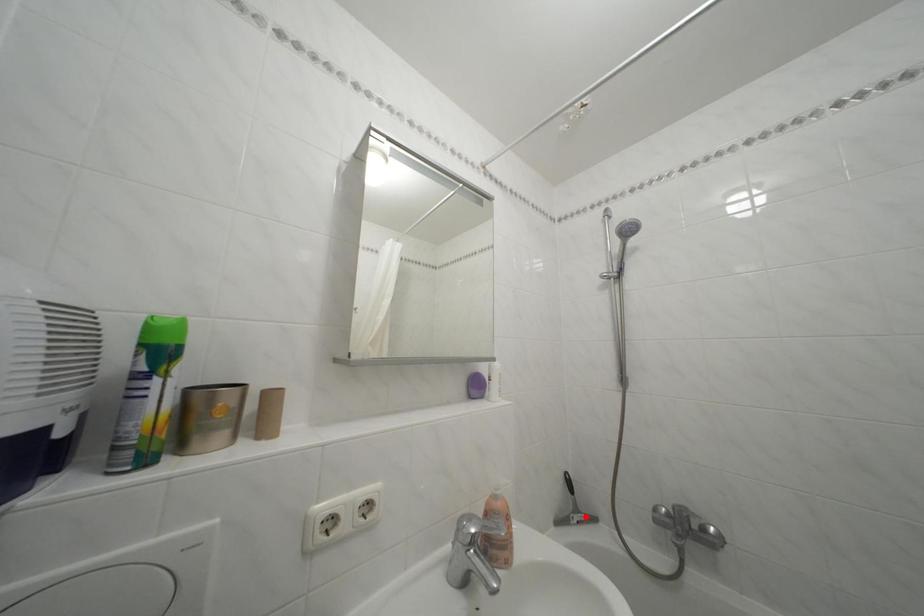
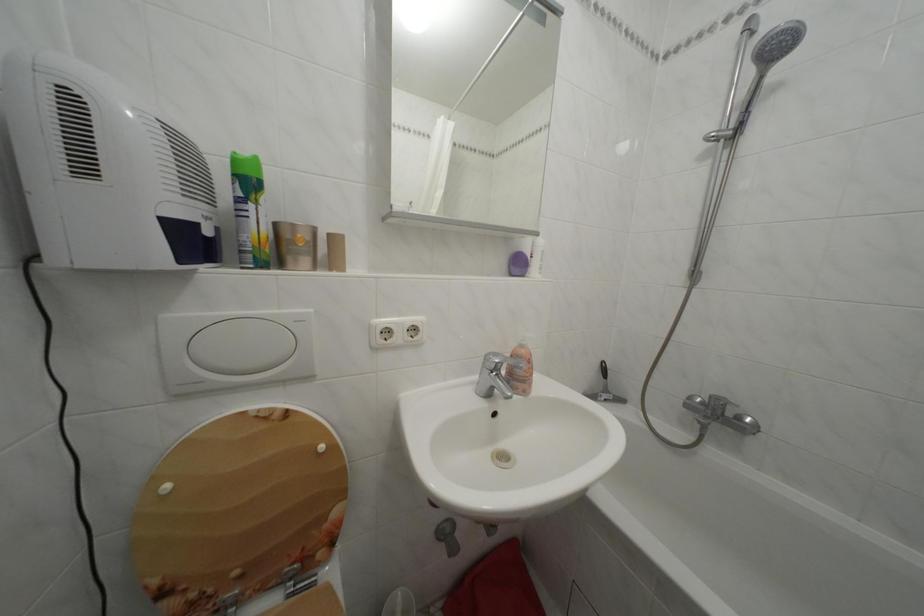
Find the pixel in the second image that matches the highlighted location in the first image.

(614, 397)